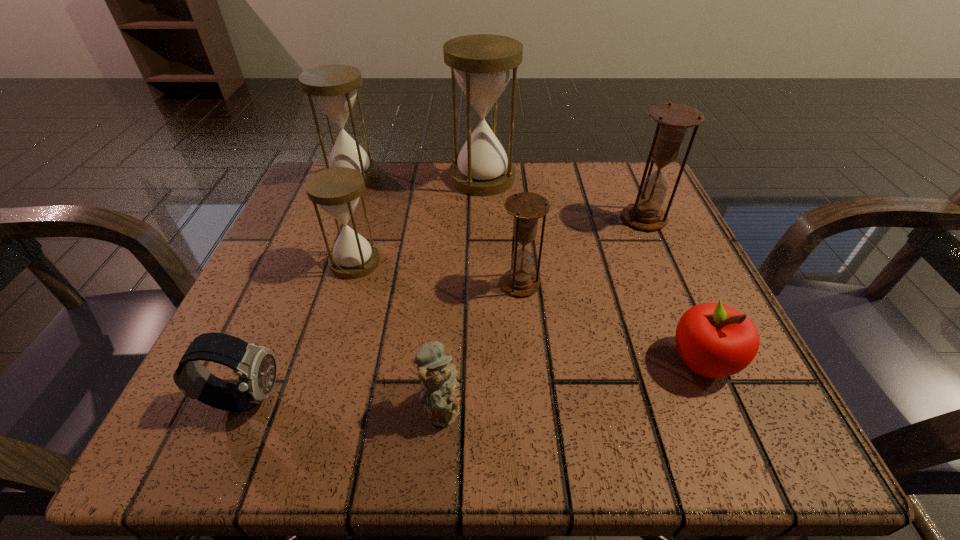
Where is `free location that satisfies the following two spatial constraints: 1. on the front side of the second smallest white hourglass; 2. on the left side of the smaller brown hourglass`? This screenshot has width=960, height=540. free location that satisfies the following two spatial constraints: 1. on the front side of the second smallest white hourglass; 2. on the left side of the smaller brown hourglass is located at coordinates click(309, 284).

Where is `free space that satisfies the following two spatial constraints: 1. on the back side of the rightmost white hourglass; 2. on the right side of the nearest white hourglass`? The width and height of the screenshot is (960, 540). free space that satisfies the following two spatial constraints: 1. on the back side of the rightmost white hourglass; 2. on the right side of the nearest white hourglass is located at coordinates (380, 178).

You are a GUI agent. You are given a task and a screenshot of the screen. Output one action in this format:
    pyautogui.click(x=<x>, y=<y>)
    Task: Click on the free point that satisfies the following two spatial constraints: 1. on the back side of the red apple; 2. on the left side of the rightmost hourglass
    Image resolution: width=960 pixels, height=540 pixels.
    Given the screenshot: What is the action you would take?
    pyautogui.click(x=641, y=219)